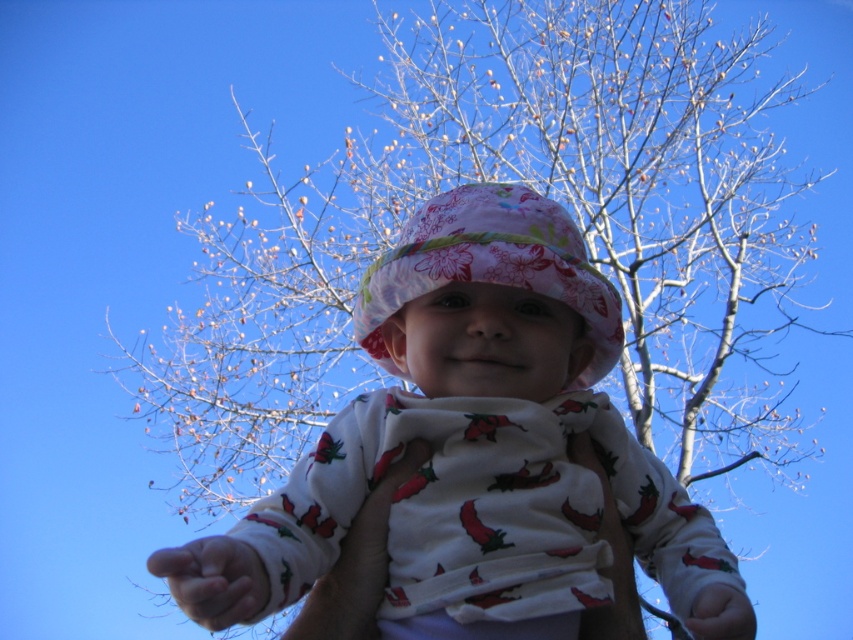
Which is below, floral fabric hat at center or smooth skin hand at lower center?

smooth skin hand at lower center

Does point (519, 220) come farther from viewer compared to point (212, 572)?

That is True.

I want to click on floral fabric hat at center, so click(490, 266).